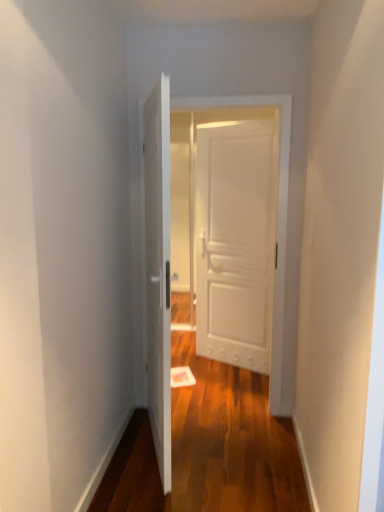
Measure the distance between point [194,106] and camera.

8.78 feet.

In the scene shown: How much space does white matte door at center, placed as the first door when sorted from back to front, occupy vertically?

It is 2.05 meters.

This screenshot has height=512, width=384. What are the coordinates of `white wooden door at center, which appears as the 2th door when viewed from the front` in the screenshot? It's located at (276, 222).

From the image's perspective, is white matte door at center, placed as the first door when sorted from back to front, above or below white wooden door at center, the second door from the back?

Clearly, from the image's perspective, white matte door at center, placed as the first door when sorted from back to front, is above white wooden door at center, the second door from the back.

Consider the image. Which object is more forward, white matte door at center, placed as the first door when sorted from back to front, or white wooden door at center, which appears as the 2th door when viewed from the front?

Positioned in front is white wooden door at center, which appears as the 2th door when viewed from the front.

Can you confirm if white matte door at center, placed as the first door when sorted from back to front, is wider than white wooden door at center, which appears as the 2th door when viewed from the front?

In fact, white matte door at center, placed as the first door when sorted from back to front, might be narrower than white wooden door at center, which appears as the 2th door when viewed from the front.

Based on the photo, from a real-world perspective, is white matte door at center, which is the third door from front to back, above or below white wooden door at center, which appears as the 2th door when viewed from the front?

From a real-world perspective, white matte door at center, which is the third door from front to back, is physically below white wooden door at center, which appears as the 2th door when viewed from the front.

Is white wooden door at center, which appears as the 2th door when viewed from the front, closer to the viewer compared to white matte door at center, placed as the first door when sorted from back to front?

Yes, it is.

From the image's perspective, would you say white wooden door at center, the second door from the back, is positioned over white matte door at center, placed as the first door when sorted from back to front?

Incorrect, from the image's perspective, white wooden door at center, the second door from the back, is lower than white matte door at center, placed as the first door when sorted from back to front.

From a real-world perspective, relative to white matte door at center, which is the third door from front to back, is white wooden door at center, the second door from the back, vertically above or below?

white wooden door at center, the second door from the back, is above white matte door at center, which is the third door from front to back.

At what (x,y) coordinates should I click in order to perform the action: click on door on the right of white wooden door at center, which appears as the 2th door when viewed from the front. Please return your answer as a coordinate pair (x, y). Looking at the image, I should click on (235, 239).

How many degrees apart are the facing directions of white matte door at center, which is the third door in back-to-front order, and white matte door at center, which is the third door from front to back?

129 degrees.

From a real-world perspective, who is located lower, white matte door at center, positioned as the first door in front-to-back order, or white matte door at center, placed as the first door when sorted from back to front?

white matte door at center, positioned as the first door in front-to-back order, is physically lower.

Is white matte door at center, which is the third door in back-to-front order, thinner than white matte door at center, which is the third door from front to back?

Incorrect, the width of white matte door at center, which is the third door in back-to-front order, is not less than that of white matte door at center, which is the third door from front to back.

This screenshot has height=512, width=384. Identify the location of door below the white matte door at center, which is the third door from front to back (from a real-world perspective). (158, 270).

Between white wooden door at center, the second door from the back, and white matte door at center, which is the third door in back-to-front order, which one has smaller width?

With smaller width is white wooden door at center, the second door from the back.

From a real-world perspective, which object stands above the other?

In real-world perspective, white wooden door at center, which appears as the 2th door when viewed from the front, is above.

Is white wooden door at center, which appears as the 2th door when viewed from the front, positioned beyond the bounds of white matte door at center, positioned as the first door in front-to-back order?

That's correct, white wooden door at center, which appears as the 2th door when viewed from the front, is outside of white matte door at center, positioned as the first door in front-to-back order.

Which of these two, white wooden door at center, the second door from the back, or white matte door at center, which is the third door in back-to-front order, stands shorter?

With less height is white matte door at center, which is the third door in back-to-front order.

Between point (152, 189) and point (157, 452), which one is positioned behind?

The point (157, 452) is behind.

Which object is positioned more to the left, white matte door at center, which is the third door in back-to-front order, or white wooden door at center, which appears as the 2th door when viewed from the front?

white matte door at center, which is the third door in back-to-front order.

Considering the sizes of white matte door at center, which is the third door in back-to-front order, and white wooden door at center, which appears as the 2th door when viewed from the front, in the image, is white matte door at center, which is the third door in back-to-front order, taller or shorter than white wooden door at center, which appears as the 2th door when viewed from the front,?

white matte door at center, which is the third door in back-to-front order, is shorter than white wooden door at center, which appears as the 2th door when viewed from the front.

Are white matte door at center, placed as the first door when sorted from back to front, and white matte door at center, which is the third door in back-to-front order, making contact?

There is a gap between white matte door at center, placed as the first door when sorted from back to front, and white matte door at center, which is the third door in back-to-front order.

From the picture: Which is in front, white matte door at center, which is the third door from front to back, or white matte door at center, which is the third door in back-to-front order?

white matte door at center, which is the third door in back-to-front order, is more forward.

Considering the relative sizes of white matte door at center, which is the third door from front to back, and white matte door at center, positioned as the first door in front-to-back order, in the image provided, is white matte door at center, which is the third door from front to back, taller than white matte door at center, positioned as the first door in front-to-back order,?

No, white matte door at center, which is the third door from front to back, is not taller than white matte door at center, positioned as the first door in front-to-back order.

From the image's perspective, which door is the 1st one below the white matte door at center, placed as the first door when sorted from back to front? Please provide its 2D coordinates.

[(276, 222)]

In order to click on the 1st door to the left of the white matte door at center, placed as the first door when sorted from back to front, starting your count from the anchor in this screenshot , I will do `click(276, 222)`.

Estimate the real-world distances between objects in this image. Which object is closer to white matte door at center, which is the third door in back-to-front order, white matte door at center, which is the third door from front to back, or white wooden door at center, which appears as the 2th door when viewed from the front?

white wooden door at center, which appears as the 2th door when viewed from the front, is positioned closer to the anchor white matte door at center, which is the third door in back-to-front order.

Which object lies further to the anchor point white matte door at center, positioned as the first door in front-to-back order, white wooden door at center, the second door from the back, or white matte door at center, placed as the first door when sorted from back to front?

Among the two, white matte door at center, placed as the first door when sorted from back to front, is located further to white matte door at center, positioned as the first door in front-to-back order.

Looking at the image, which one is located closer to white matte door at center, which is the third door from front to back, white matte door at center, positioned as the first door in front-to-back order, or white wooden door at center, the second door from the back?

white wooden door at center, the second door from the back, is positioned closer to the anchor white matte door at center, which is the third door from front to back.

When comparing their distances from white wooden door at center, the second door from the back, does white matte door at center, which is the third door from front to back, or white matte door at center, positioned as the first door in front-to-back order, seem closer?

white matte door at center, positioned as the first door in front-to-back order, is positioned closer to the anchor white wooden door at center, the second door from the back.

Considering their positions, is white wooden door at center, which appears as the 2th door when viewed from the front, positioned closer to white matte door at center, which is the third door from front to back, than white matte door at center, which is the third door in back-to-front order?

white wooden door at center, which appears as the 2th door when viewed from the front.

From the image, which object appears to be farther from white wooden door at center, which appears as the 2th door when viewed from the front, white matte door at center, which is the third door in back-to-front order, or white matte door at center, placed as the first door when sorted from back to front?

white matte door at center, placed as the first door when sorted from back to front, is further to white wooden door at center, which appears as the 2th door when viewed from the front.

Image resolution: width=384 pixels, height=512 pixels. What are the coordinates of `door between white matte door at center, positioned as the first door in front-to-back order, and white matte door at center, placed as the first door when sorted from back to front, from front to back` in the screenshot? It's located at (276, 222).